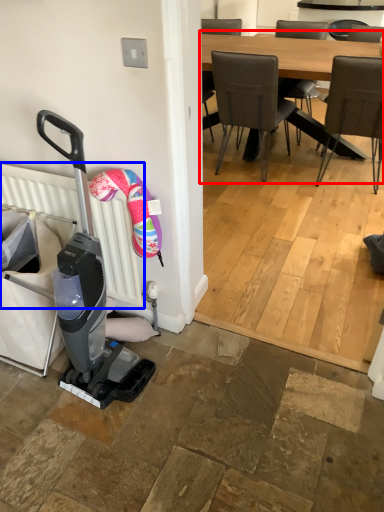
Question: Which object is closer to the camera taking this photo, kitchen & dining room table (highlighted by a red box) or radiator (highlighted by a blue box)?

Choices:
 (A) kitchen & dining room table
 (B) radiator

Answer: (B)